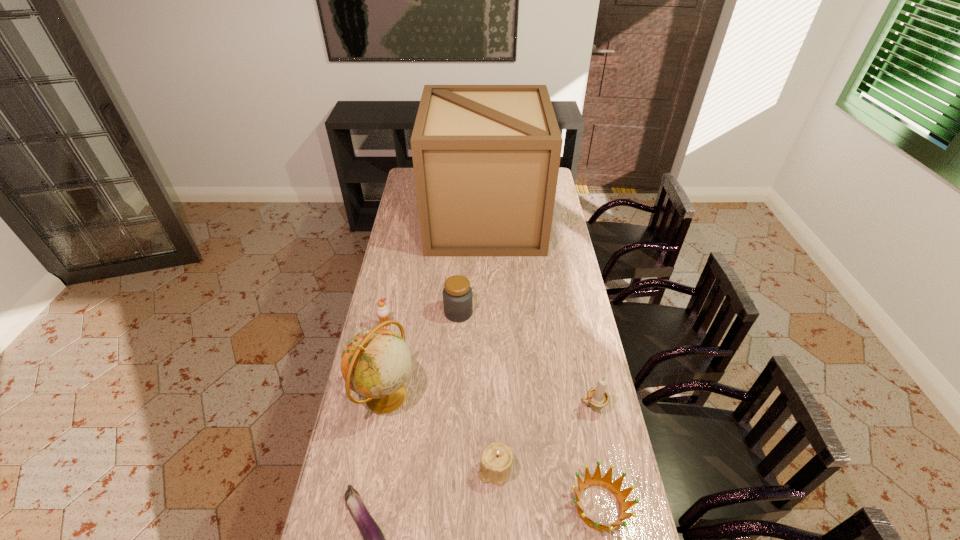
Locate an element on the screen. This screenshot has width=960, height=540. icecream located in the left edge section of the desktop is located at coordinates [382, 310].

Where is `box that is at the right edge`? Image resolution: width=960 pixels, height=540 pixels. box that is at the right edge is located at coordinates (486, 158).

Where is `candle_holder that is at the right edge`? The width and height of the screenshot is (960, 540). candle_holder that is at the right edge is located at coordinates (598, 398).

In the image, there is a desktop. Identify the location of free space at the left edge. (382, 279).

Identify the location of vacant space at the right edge of the desktop. The width and height of the screenshot is (960, 540). (576, 269).

At what (x,y) coordinates should I click in order to perform the action: click on vacant space that's between the shorter candle_holder and the icecream. Please return your answer as a coordinate pair (x, y). The image size is (960, 540). Looking at the image, I should click on (441, 397).

In order to click on free space between the second tallest object and the shorter candle_holder in this screenshot , I will do `click(441, 433)`.

At what (x,y) coordinates should I click in order to perform the action: click on free spot between the box and the nearer candle_holder. Please return your answer as a coordinate pair (x, y). The height and width of the screenshot is (540, 960). Looking at the image, I should click on (490, 345).

The image size is (960, 540). I want to click on free space that is in between the tallest object and the globe, so click(x=435, y=308).

You are a GUI agent. You are given a task and a screenshot of the screen. Output one action in this format:
    pyautogui.click(x=<x>, y=<y>)
    Task: Click on the free space between the icecream and the right candle_holder
    The height and width of the screenshot is (540, 960).
    Given the screenshot: What is the action you would take?
    pyautogui.click(x=489, y=366)